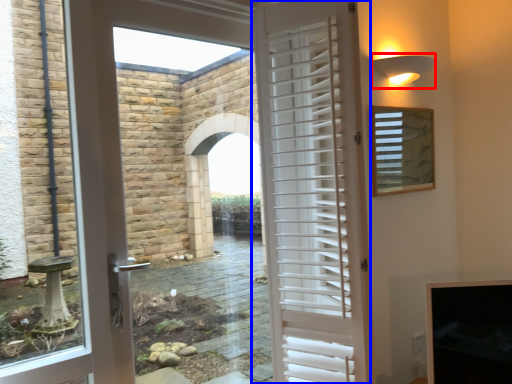
Question: Among these objects, which one is nearest to the camera, light fixture (highlighted by a red box) or door (highlighted by a blue box)?

Choices:
 (A) light fixture
 (B) door

Answer: (B)